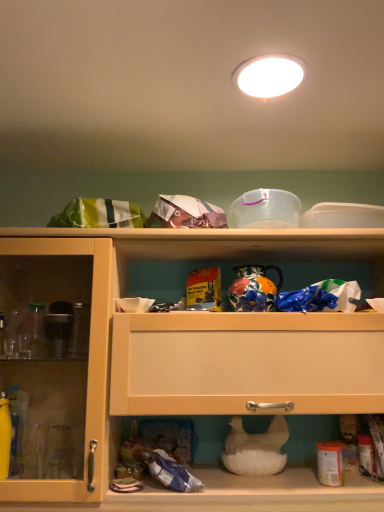
Find the location of a particular element. white glossy light fixture at upper center is located at coordinates (270, 77).

What do you see at coordinates (270, 77) in the screenshot? I see `white glossy light fixture at upper center` at bounding box center [270, 77].

In order to face white glossy light fixture at upper center, should I rotate leftwards or rightwards?

You should look right and rotate roughly 10.395 degrees.

Where is `matte wood cabinet at upper center`? matte wood cabinet at upper center is located at coordinates (184, 362).

In order to face matte wood cabinet at upper center, should I rotate leftwards or rightwards?

You should rotate right by 1.242 degrees.

What do you see at coordinates (184, 362) in the screenshot?
I see `matte wood cabinet at upper center` at bounding box center [184, 362].

What are the coordinates of `white glossy light fixture at upper center` in the screenshot? It's located at (270, 77).

Which is more to the right, white glossy light fixture at upper center or matte wood cabinet at upper center?

white glossy light fixture at upper center is more to the right.

Which object is closer to the camera, white glossy light fixture at upper center or matte wood cabinet at upper center?

white glossy light fixture at upper center is in front.

Is point (287, 64) positioned after point (129, 403)?

No, (287, 64) is in front of (129, 403).

From the image's perspective, which is below, white glossy light fixture at upper center or matte wood cabinet at upper center?

matte wood cabinet at upper center, from the image's perspective.

From a real-world perspective, which is physically below, white glossy light fixture at upper center or matte wood cabinet at upper center?

From a 3D spatial view, matte wood cabinet at upper center is below.

Can you confirm if white glossy light fixture at upper center is thinner than matte wood cabinet at upper center?

Yes, white glossy light fixture at upper center is thinner than matte wood cabinet at upper center.

Does white glossy light fixture at upper center have a greater height compared to matte wood cabinet at upper center?

In fact, white glossy light fixture at upper center may be shorter than matte wood cabinet at upper center.

Is white glossy light fixture at upper center bigger or smaller than matte wood cabinet at upper center?

In the image, white glossy light fixture at upper center appears to be smaller than matte wood cabinet at upper center.

Is white glossy light fixture at upper center not within matte wood cabinet at upper center?

Yes.

Is white glossy light fixture at upper center not near matte wood cabinet at upper center?

Actually, white glossy light fixture at upper center and matte wood cabinet at upper center are a little close together.

In the scene shown: Is white glossy light fixture at upper center facing away from matte wood cabinet at upper center?

That's not correct — white glossy light fixture at upper center is not looking away from matte wood cabinet at upper center.

How many degrees apart are the facing directions of white glossy light fixture at upper center and matte wood cabinet at upper center?

The angular difference between white glossy light fixture at upper center and matte wood cabinet at upper center is 89.2 degrees.

How distant is white glossy light fixture at upper center from matte wood cabinet at upper center?

The distance of white glossy light fixture at upper center from matte wood cabinet at upper center is 30.98 inches.

You are a GUI agent. You are given a task and a screenshot of the screen. Output one action in this format:
    pyautogui.click(x=<x>, y=<y>)
    Task: Click on the lighting that is above the matte wood cabinet at upper center (from a real-world perspective)
    This screenshot has height=512, width=384.
    Given the screenshot: What is the action you would take?
    pyautogui.click(x=270, y=77)

Considering the relative positions of matte wood cabinet at upper center and white glossy light fixture at upper center in the image provided, is matte wood cabinet at upper center to the left of white glossy light fixture at upper center from the viewer's perspective?

Yes, matte wood cabinet at upper center is to the left of white glossy light fixture at upper center.

Is matte wood cabinet at upper center closer to the viewer compared to white glossy light fixture at upper center?

No, matte wood cabinet at upper center is further to the viewer.

Considering the points (97, 495) and (272, 57), which point is behind, point (97, 495) or point (272, 57)?

The point (97, 495) is more distant.

From the image's perspective, which one is positioned lower, matte wood cabinet at upper center or white glossy light fixture at upper center?

matte wood cabinet at upper center appears lower in the image.

From a real-world perspective, which object rests below the other?

In real-world perspective, matte wood cabinet at upper center is lower.

Looking at their sizes, would you say matte wood cabinet at upper center is wider or thinner than white glossy light fixture at upper center?

matte wood cabinet at upper center is wider than white glossy light fixture at upper center.

Is matte wood cabinet at upper center taller than white glossy light fixture at upper center?

Yes.

Between matte wood cabinet at upper center and white glossy light fixture at upper center, which one has larger size?

matte wood cabinet at upper center.

Is matte wood cabinet at upper center inside the boundaries of white glossy light fixture at upper center, or outside?

matte wood cabinet at upper center exists outside the volume of white glossy light fixture at upper center.

Would you say matte wood cabinet at upper center is a long distance from white glossy light fixture at upper center?

That's not correct — matte wood cabinet at upper center is a little close to white glossy light fixture at upper center.

Is matte wood cabinet at upper center oriented away from white glossy light fixture at upper center?

No, matte wood cabinet at upper center's orientation is not away from white glossy light fixture at upper center.

Locate an element on the screen. The height and width of the screenshot is (512, 384). cabinetry that is on the left side of white glossy light fixture at upper center is located at coordinates (184, 362).

Find the location of a particular element. Image resolution: width=384 pixels, height=512 pixels. cabinetry below the white glossy light fixture at upper center (from a real-world perspective) is located at coordinates (184, 362).

There is a matte wood cabinet at upper center. Identify the location of lighting above it (from a real-world perspective). (270, 77).